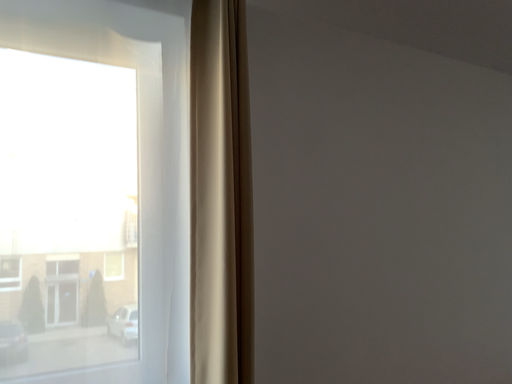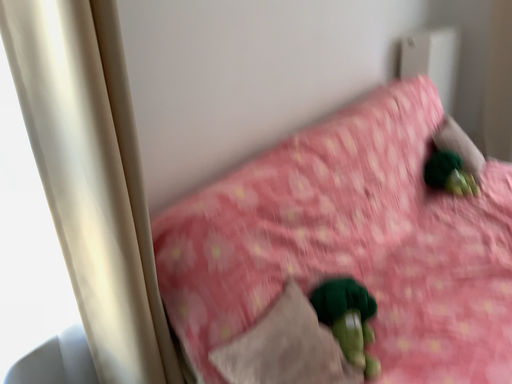
Question: Which way did the camera rotate in the video?

Choices:
 (A) rotated left
 (B) rotated right

Answer: (B)